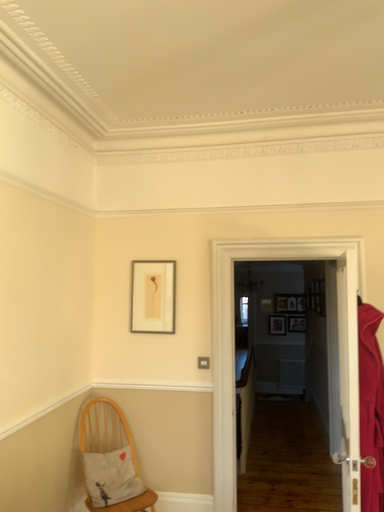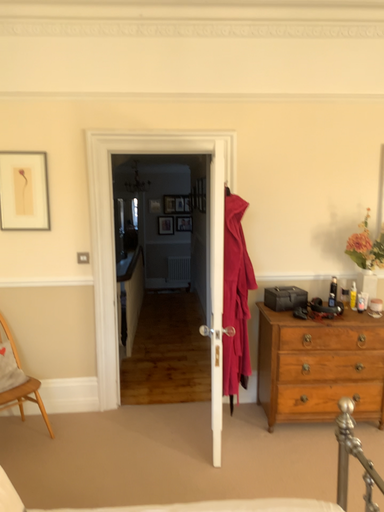
Question: How did the camera likely rotate when shooting the video?

Choices:
 (A) rotated right
 (B) rotated left

Answer: (A)